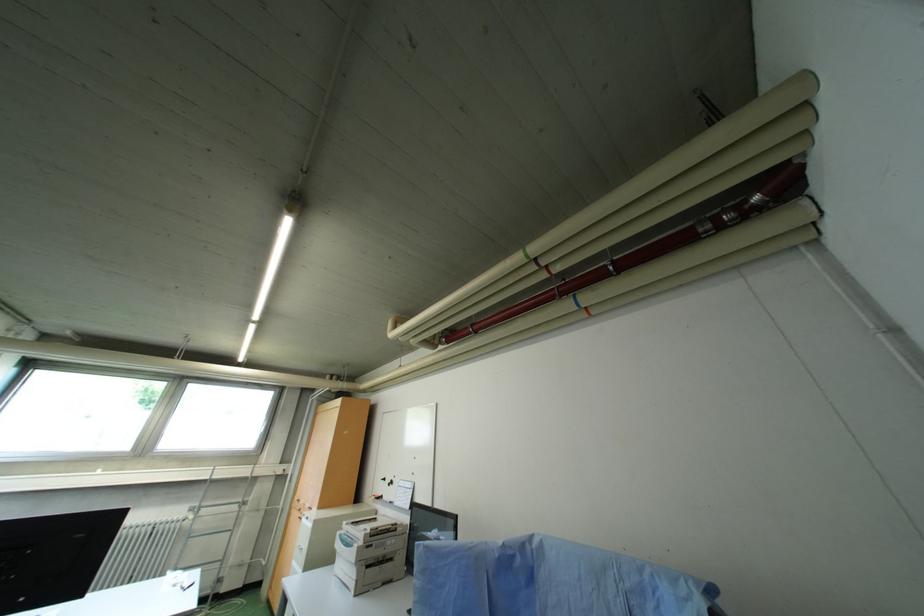
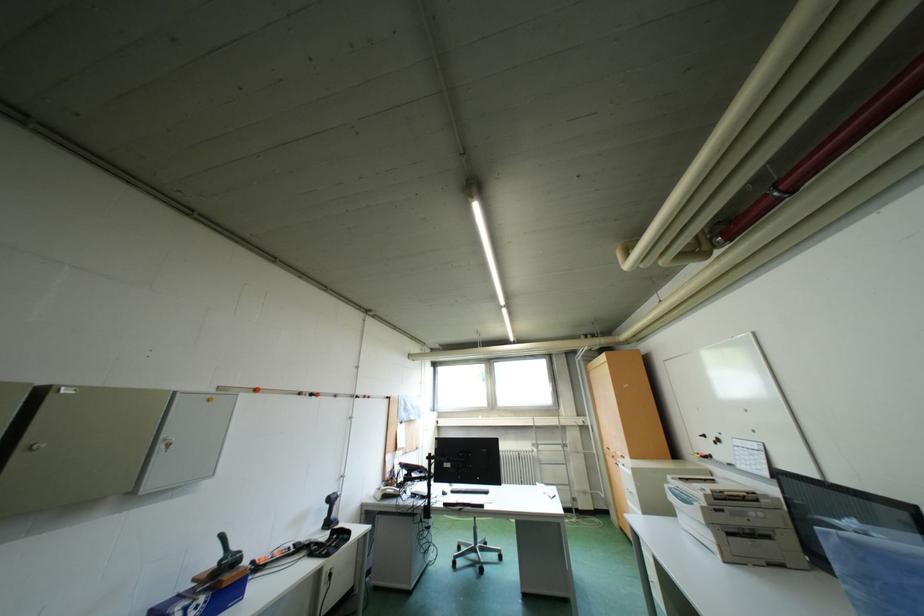
Question: The camera is either moving clockwise (left) or counter-clockwise (right) around the object. The first image is from the beginning of the video and the second image is from the end. Is the camera moving left or right when shooting the video?

Choices:
 (A) Left
 (B) Right

Answer: (B)